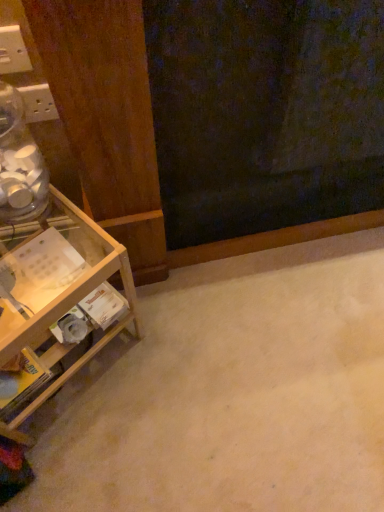
What is the approximate height of wooden shelf at left?

wooden shelf at left is 16.77 inches in height.

Looking at this image, what is the approximate width of wooden shelf at left?

14.54 inches.

Describe the element at coordinates (38, 103) in the screenshot. I see `white plastic electric outlet at upper left, positioned as the first electric outlet in bottom-to-top order` at that location.

Image resolution: width=384 pixels, height=512 pixels. What do you see at coordinates (13, 51) in the screenshot? I see `white plastic electric outlet at upper left, the 1th electric outlet positioned from the top` at bounding box center [13, 51].

Find the location of a particular element. wooden shelf at left is located at coordinates (58, 296).

Measure the distance from white plastic electric outlet at upper left, the 2th electric outlet when ordered from front to back, to white plastic electric outlet at upper left, marked as the second electric outlet in a back-to-front arrangement.

They are 6.71 centimeters apart.

Considering the sizes of white plastic electric outlet at upper left, the 2th electric outlet when ordered from front to back, and white plastic electric outlet at upper left, the 1th electric outlet positioned from the top, in the image, is white plastic electric outlet at upper left, the 2th electric outlet when ordered from front to back, bigger or smaller than white plastic electric outlet at upper left, the 1th electric outlet positioned from the top,?

Considering their sizes, white plastic electric outlet at upper left, the 2th electric outlet when ordered from front to back, takes up more space than white plastic electric outlet at upper left, the 1th electric outlet positioned from the top.

Which object is positioned more to the left, white plastic electric outlet at upper left, the 2th electric outlet when ordered from front to back, or white plastic electric outlet at upper left, the 1th electric outlet in the front-to-back sequence?

From the viewer's perspective, white plastic electric outlet at upper left, the 2th electric outlet when ordered from front to back, appears more on the left side.

Would you say white plastic electric outlet at upper left, acting as the 2th electric outlet starting from the top, is part of white plastic electric outlet at upper left, marked as the second electric outlet in a back-to-front arrangement,'s contents?

No, white plastic electric outlet at upper left, acting as the 2th electric outlet starting from the top, is not surrounded by white plastic electric outlet at upper left, marked as the second electric outlet in a back-to-front arrangement.

Between point (22, 66) and point (36, 86), which one is positioned in front?

Point (22, 66)

From the image's perspective, relative to white plastic electric outlet at upper left, the 1th electric outlet viewed from the back, is white plastic electric outlet at upper left, which ranks as the second electric outlet in bottom-to-top order, above or below?

white plastic electric outlet at upper left, which ranks as the second electric outlet in bottom-to-top order, is situated higher than white plastic electric outlet at upper left, the 1th electric outlet viewed from the back, in the image.

Is white plastic electric outlet at upper left, marked as the second electric outlet in a back-to-front arrangement, next to white plastic electric outlet at upper left, the 2th electric outlet when ordered from front to back, and touching it?

Yes, white plastic electric outlet at upper left, marked as the second electric outlet in a back-to-front arrangement, is beside white plastic electric outlet at upper left, the 2th electric outlet when ordered from front to back.

Which of these two, wooden shelf at left or white plastic electric outlet at upper left, which ranks as the second electric outlet in bottom-to-top order, is thinner?

white plastic electric outlet at upper left, which ranks as the second electric outlet in bottom-to-top order.

In the scene shown: From the image's perspective, which object appears higher, wooden shelf at left or white plastic electric outlet at upper left, the 1th electric outlet positioned from the top?

white plastic electric outlet at upper left, the 1th electric outlet positioned from the top, appears higher in the image.

Considering the positions of objects wooden shelf at left and white plastic electric outlet at upper left, the 1th electric outlet positioned from the top, in the image provided, who is more to the left, wooden shelf at left or white plastic electric outlet at upper left, the 1th electric outlet positioned from the top,?

Positioned to the left is wooden shelf at left.

The height and width of the screenshot is (512, 384). Identify the location of shelf that appears below the white plastic electric outlet at upper left, the 1th electric outlet positioned from the top (from a real-world perspective). (58, 296).

How many degrees apart are the facing directions of wooden shelf at left and white plastic electric outlet at upper left, positioned as the first electric outlet in bottom-to-top order?

34.1 degrees separate the facing orientations of wooden shelf at left and white plastic electric outlet at upper left, positioned as the first electric outlet in bottom-to-top order.

Can you confirm if wooden shelf at left is taller than white plastic electric outlet at upper left, acting as the 2th electric outlet starting from the top?

Indeed, wooden shelf at left has a greater height compared to white plastic electric outlet at upper left, acting as the 2th electric outlet starting from the top.

Can white plastic electric outlet at upper left, positioned as the first electric outlet in bottom-to-top order, be found inside wooden shelf at left?

Actually, white plastic electric outlet at upper left, positioned as the first electric outlet in bottom-to-top order, is outside wooden shelf at left.

Looking at this image, who is smaller, wooden shelf at left or white plastic electric outlet at upper left, positioned as the first electric outlet in bottom-to-top order?

white plastic electric outlet at upper left, positioned as the first electric outlet in bottom-to-top order, is smaller.

Is white plastic electric outlet at upper left, which ranks as the second electric outlet in bottom-to-top order, taller or shorter than wooden shelf at left?

white plastic electric outlet at upper left, which ranks as the second electric outlet in bottom-to-top order, is shorter than wooden shelf at left.

Does white plastic electric outlet at upper left, the 1th electric outlet in the front-to-back sequence, turn towards wooden shelf at left?

No, white plastic electric outlet at upper left, the 1th electric outlet in the front-to-back sequence, is not turned towards wooden shelf at left.

Is white plastic electric outlet at upper left, the 1th electric outlet in the front-to-back sequence, in contact with wooden shelf at left?

white plastic electric outlet at upper left, the 1th electric outlet in the front-to-back sequence, is not next to wooden shelf at left, and they're not touching.

Is white plastic electric outlet at upper left, marked as the second electric outlet in a back-to-front arrangement, not inside wooden shelf at left?

Indeed, white plastic electric outlet at upper left, marked as the second electric outlet in a back-to-front arrangement, is completely outside wooden shelf at left.

Where is `shelf below the white plastic electric outlet at upper left, positioned as the first electric outlet in bottom-to-top order (from the image's perspective)`? The image size is (384, 512). shelf below the white plastic electric outlet at upper left, positioned as the first electric outlet in bottom-to-top order (from the image's perspective) is located at coordinates (58, 296).

Does white plastic electric outlet at upper left, positioned as the first electric outlet in bottom-to-top order, have a greater width compared to wooden shelf at left?

No.

Is white plastic electric outlet at upper left, acting as the 2th electric outlet starting from the top, at the left side of wooden shelf at left?

No, white plastic electric outlet at upper left, acting as the 2th electric outlet starting from the top, is not to the left of wooden shelf at left.

Is the position of white plastic electric outlet at upper left, the 2th electric outlet when ordered from front to back, more distant than that of wooden shelf at left?

Yes, it is.

Where is `electric outlet behind the white plastic electric outlet at upper left, which ranks as the second electric outlet in bottom-to-top order`? electric outlet behind the white plastic electric outlet at upper left, which ranks as the second electric outlet in bottom-to-top order is located at coordinates click(x=38, y=103).

Identify the location of electric outlet above the white plastic electric outlet at upper left, acting as the 2th electric outlet starting from the top (from the image's perspective). The image size is (384, 512). (13, 51).

Estimate the real-world distances between objects in this image. Which object is closer to white plastic electric outlet at upper left, acting as the 2th electric outlet starting from the top, white plastic electric outlet at upper left, marked as the second electric outlet in a back-to-front arrangement, or wooden shelf at left?

The object closer to white plastic electric outlet at upper left, acting as the 2th electric outlet starting from the top, is white plastic electric outlet at upper left, marked as the second electric outlet in a back-to-front arrangement.

When comparing their distances from wooden shelf at left, does white plastic electric outlet at upper left, marked as the second electric outlet in a back-to-front arrangement, or white plastic electric outlet at upper left, acting as the 2th electric outlet starting from the top, seem further?

white plastic electric outlet at upper left, marked as the second electric outlet in a back-to-front arrangement, lies further to wooden shelf at left than the other object.

Based on the photo, when comparing their distances from white plastic electric outlet at upper left, acting as the 2th electric outlet starting from the top, does wooden shelf at left or white plastic electric outlet at upper left, the 1th electric outlet in the front-to-back sequence, seem further?

wooden shelf at left is positioned further to the anchor white plastic electric outlet at upper left, acting as the 2th electric outlet starting from the top.

When comparing their distances from white plastic electric outlet at upper left, the 1th electric outlet positioned from the top, does white plastic electric outlet at upper left, the 1th electric outlet viewed from the back, or wooden shelf at left seem closer?

white plastic electric outlet at upper left, the 1th electric outlet viewed from the back.

From the image, which object appears to be nearer to wooden shelf at left, white plastic electric outlet at upper left, acting as the 2th electric outlet starting from the top, or white plastic electric outlet at upper left, the 1th electric outlet positioned from the top?

The object closer to wooden shelf at left is white plastic electric outlet at upper left, acting as the 2th electric outlet starting from the top.

Which object lies nearer to the anchor point white plastic electric outlet at upper left, the 1th electric outlet positioned from the top, wooden shelf at left or white plastic electric outlet at upper left, positioned as the first electric outlet in bottom-to-top order?

The object closer to white plastic electric outlet at upper left, the 1th electric outlet positioned from the top, is white plastic electric outlet at upper left, positioned as the first electric outlet in bottom-to-top order.

Where is `electric outlet between white plastic electric outlet at upper left, which ranks as the second electric outlet in bottom-to-top order, and wooden shelf at left, in the vertical direction`? The width and height of the screenshot is (384, 512). electric outlet between white plastic electric outlet at upper left, which ranks as the second electric outlet in bottom-to-top order, and wooden shelf at left, in the vertical direction is located at coordinates coord(38,103).